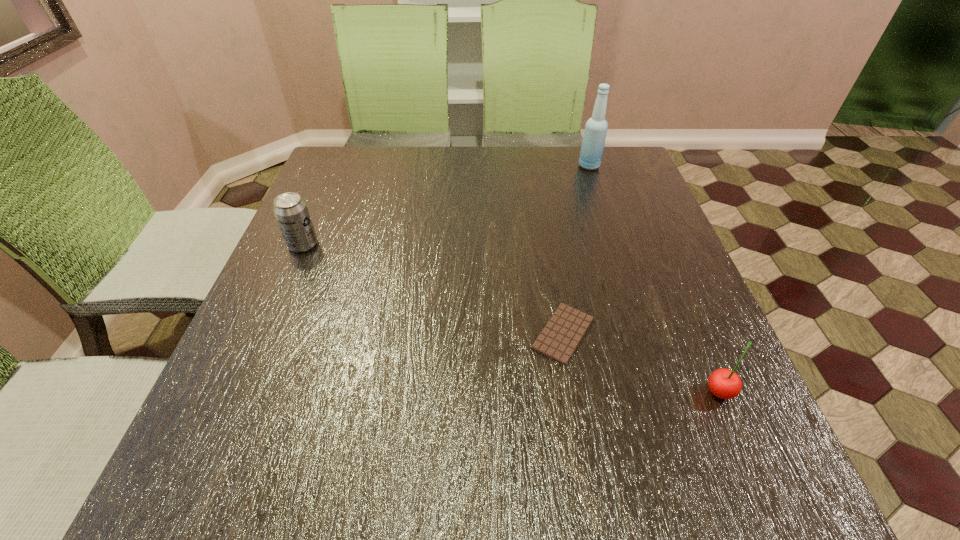
Find the location of a particular element. This screenshot has width=960, height=540. free space located on the back of the cherry is located at coordinates (660, 255).

Where is `free space located on the left of the third farthest object`? Image resolution: width=960 pixels, height=540 pixels. free space located on the left of the third farthest object is located at coordinates (498, 334).

Locate an element on the screen. The width and height of the screenshot is (960, 540). object that is positioned at the far edge is located at coordinates (596, 127).

Where is `object that is at the left edge`? This screenshot has width=960, height=540. object that is at the left edge is located at coordinates (291, 212).

This screenshot has height=540, width=960. What are the coordinates of `bottle located in the right edge section of the desktop` in the screenshot? It's located at (596, 127).

Locate an element on the screen. This screenshot has height=540, width=960. cherry that is at the right edge is located at coordinates (723, 383).

Identify the location of object positioned at the far right corner. (596, 127).

What are the coordinates of `vacant area at the far edge` in the screenshot? It's located at (385, 182).

This screenshot has width=960, height=540. What are the coordinates of `vacant space at the near edge of the desktop` in the screenshot? It's located at (443, 489).

The width and height of the screenshot is (960, 540). In order to click on vacant area at the left edge in this screenshot , I will do `click(321, 193)`.